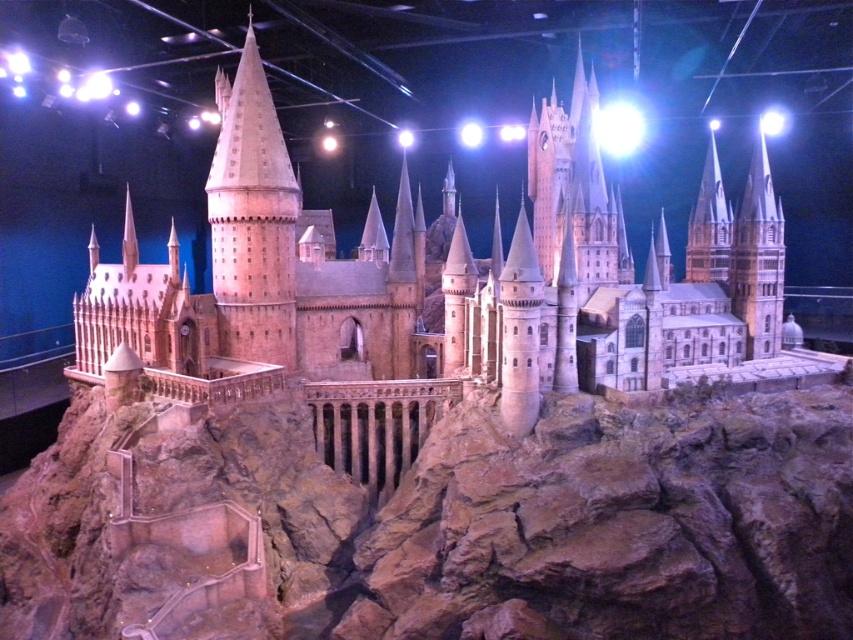
Does point (241, 211) lie behind point (746, 198)?

No, it is in front of (746, 198).

Based on the photo, does smooth beige stone tower at center have a greater height compared to smooth stone tower at right?

Correct, smooth beige stone tower at center is much taller as smooth stone tower at right.

This screenshot has width=853, height=640. I want to click on smooth beige stone tower at center, so click(x=252, y=220).

Which is below, smooth beige stone tower at center or smooth stone spire at upper right?

smooth stone spire at upper right

Is point (236, 180) positioned before point (698, 236)?

That is True.

Where is `smooth beige stone tower at center`? Image resolution: width=853 pixels, height=640 pixels. smooth beige stone tower at center is located at coordinates (252, 220).

Between smooth stone tower at right and smooth stone spire at upper right, which one has less height?

smooth stone spire at upper right

Identify the location of smooth stone tower at right. The width and height of the screenshot is (853, 640). (x=758, y=259).

What are the coordinates of `smooth stone tower at right` in the screenshot? It's located at (758, 259).